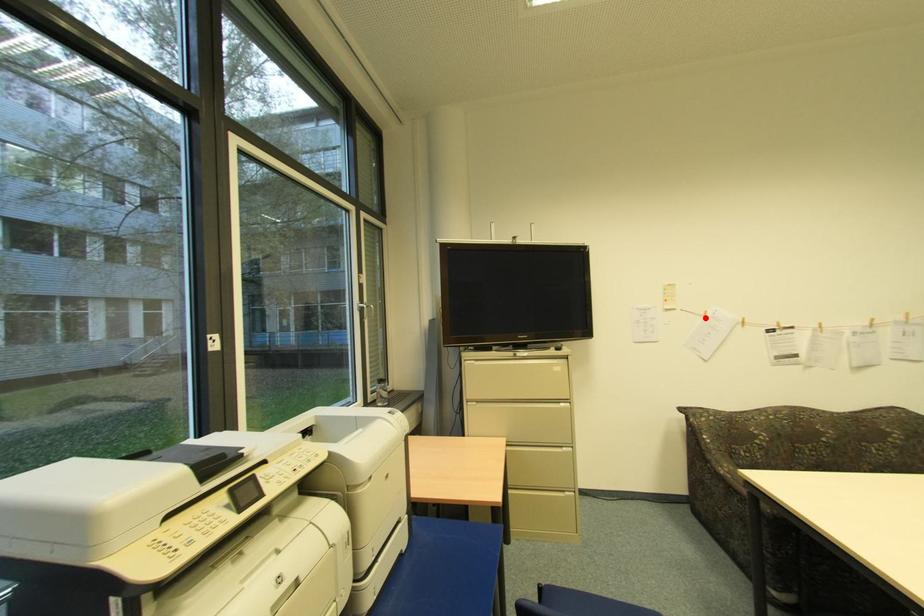
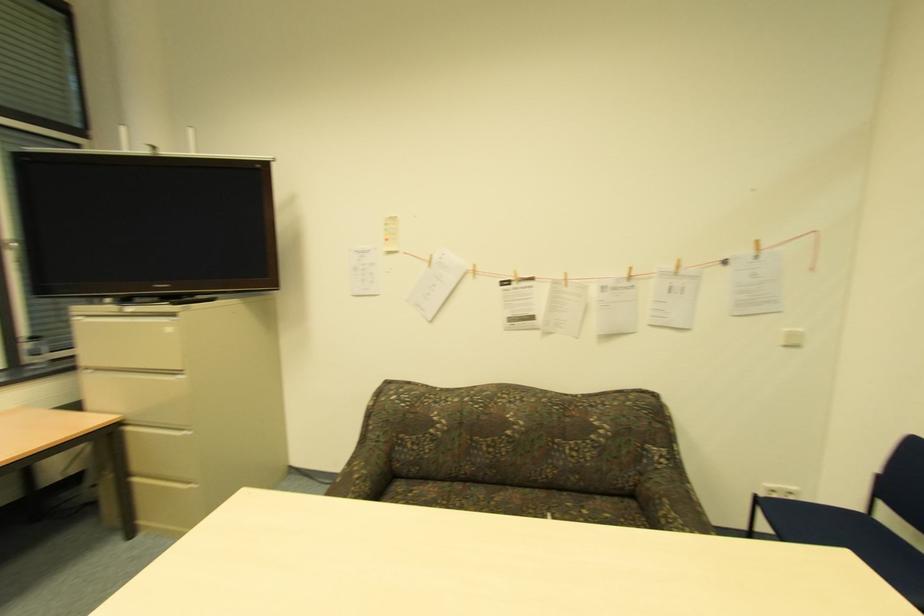
Question: I am providing you with two images of the same scene from different viewpoints. Given a red point in image1, look at the same physical point in image2. Is it:

Choices:
 (A) Closer to the viewpoint
 (B) Farther from the viewpoint

Answer: (A)